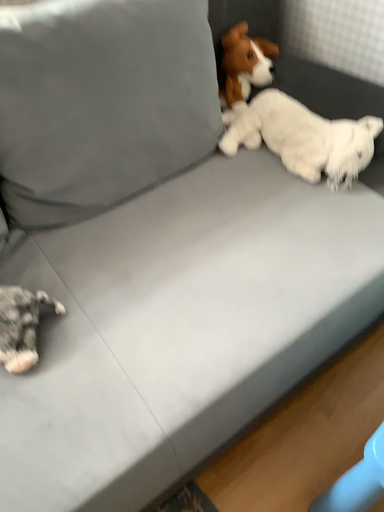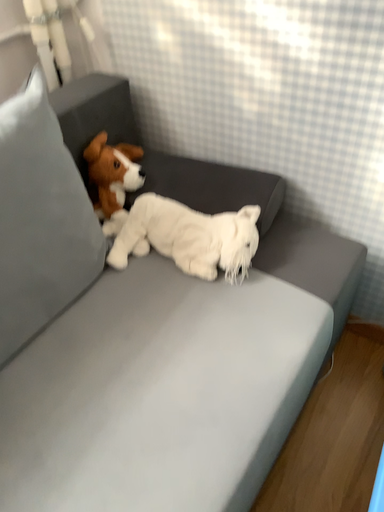
Question: Which way did the camera rotate in the video?

Choices:
 (A) rotated upward
 (B) rotated downward

Answer: (A)